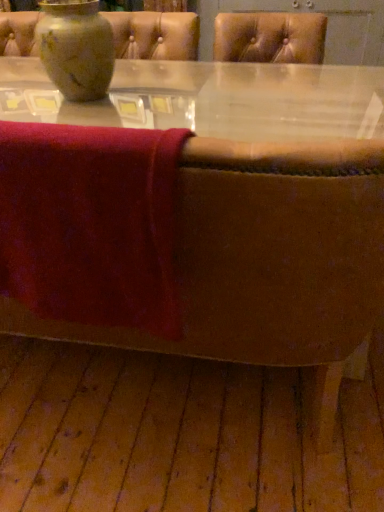
What do you see at coordinates (91, 223) in the screenshot?
I see `velvety red blanket at lower left` at bounding box center [91, 223].

In order to face velvety red blanket at lower left, should I rotate leftwards or rightwards?

Turn left approximately 15.761 degrees to face it.

The image size is (384, 512). I want to click on velvety red blanket at lower left, so pos(91,223).

This screenshot has width=384, height=512. I want to click on velvety red blanket at lower left, so click(91, 223).